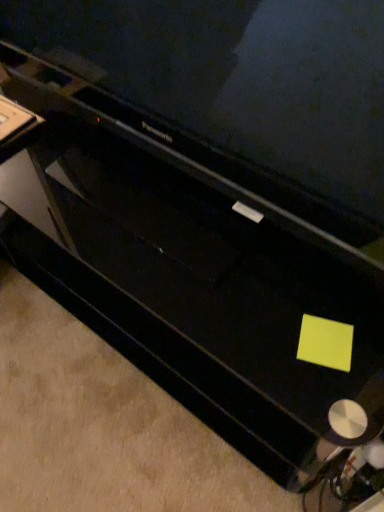
Locate an element on the screen. This screenshot has width=384, height=512. matte black monitor at center is located at coordinates (241, 76).

This screenshot has height=512, width=384. What do you see at coordinates (241, 76) in the screenshot? I see `matte black monitor at center` at bounding box center [241, 76].

Image resolution: width=384 pixels, height=512 pixels. What are the coordinates of `matte black monitor at center` in the screenshot? It's located at (241, 76).